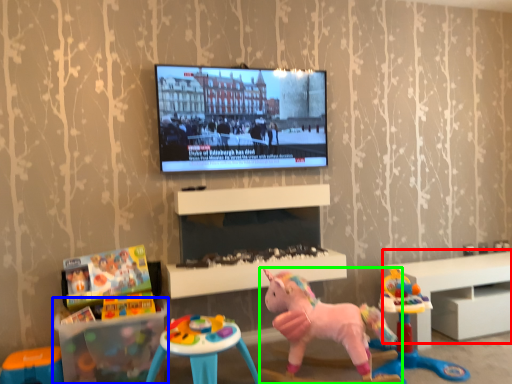
Question: Which is nearer to the furniture (highlighted by a red box)? table (highlighted by a blue box) or toy (highlighted by a green box).

Choices:
 (A) table
 (B) toy

Answer: (B)